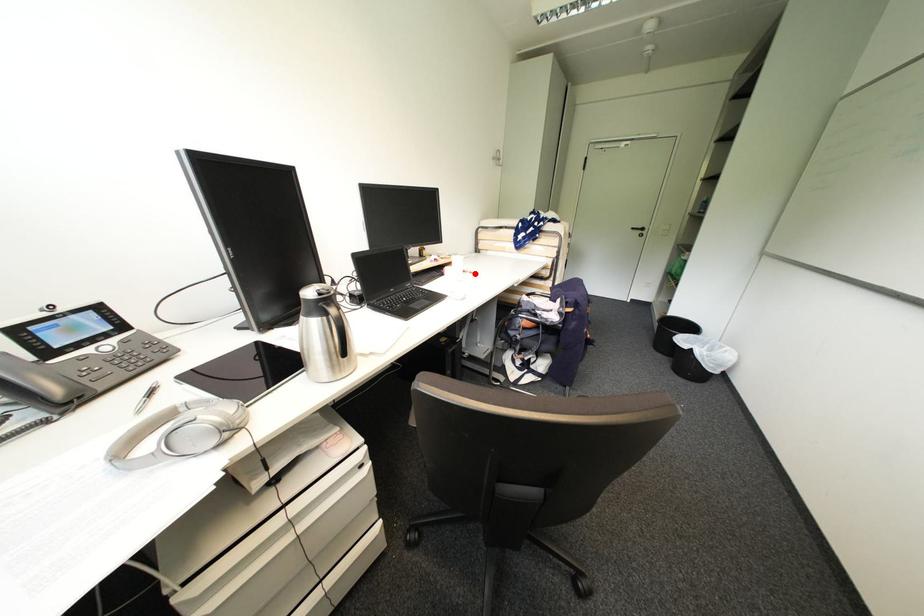
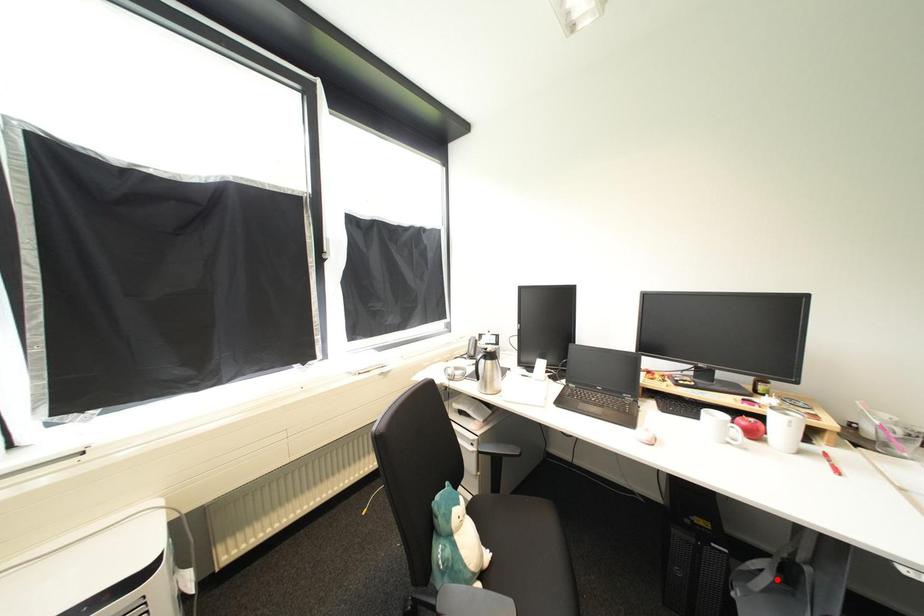
I am providing you with two images of the same scene from different viewpoints. A red point is marked on the first image and another point is marked on the second image. Is the red point in image1 aligned with the point shown in image2?

No